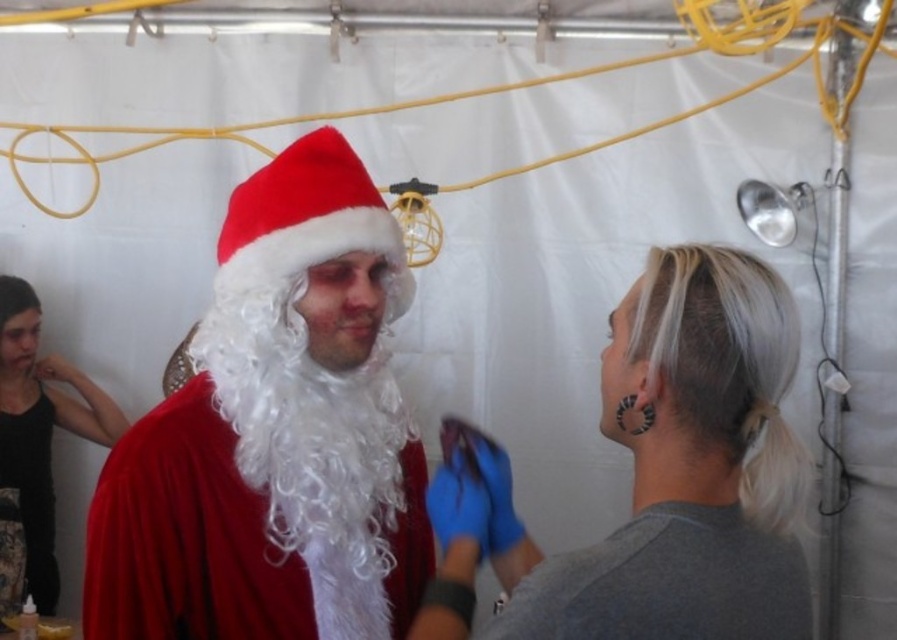
Measure the distance from matte red santa hat at upper left to velvet black tank top at lower left.

The distance of matte red santa hat at upper left from velvet black tank top at lower left is 7.59 feet.

Is matte red santa hat at upper left thinner than velvet black tank top at lower left?

No.

Is point (527, 545) positioned in front of point (49, 557)?

Yes.

This screenshot has height=640, width=897. I want to click on matte red santa hat at upper left, so click(680, 468).

Can you confirm if matte red santa hat at upper left is thinner than black matte tank top at left?

A: In fact, matte red santa hat at upper left might be wider than black matte tank top at left.

Can you confirm if matte red santa hat at upper left is positioned below black matte tank top at left?

Actually, matte red santa hat at upper left is above black matte tank top at left.

At what (x,y) coordinates should I click in order to perform the action: click on matte red santa hat at upper left. Please return your answer as a coordinate pair (x, y). Image resolution: width=897 pixels, height=640 pixels. Looking at the image, I should click on (680, 468).

Who is lower down, gray matte shirt at lower right or velvet black tank top at lower left?

velvet black tank top at lower left is lower down.

The height and width of the screenshot is (640, 897). In order to click on gray matte shirt at lower right in this screenshot , I will do (665, 582).

This screenshot has width=897, height=640. What are the coordinates of `gray matte shirt at lower right` in the screenshot? It's located at (665, 582).

Image resolution: width=897 pixels, height=640 pixels. In order to click on gray matte shirt at lower right in this screenshot , I will do `click(665, 582)`.